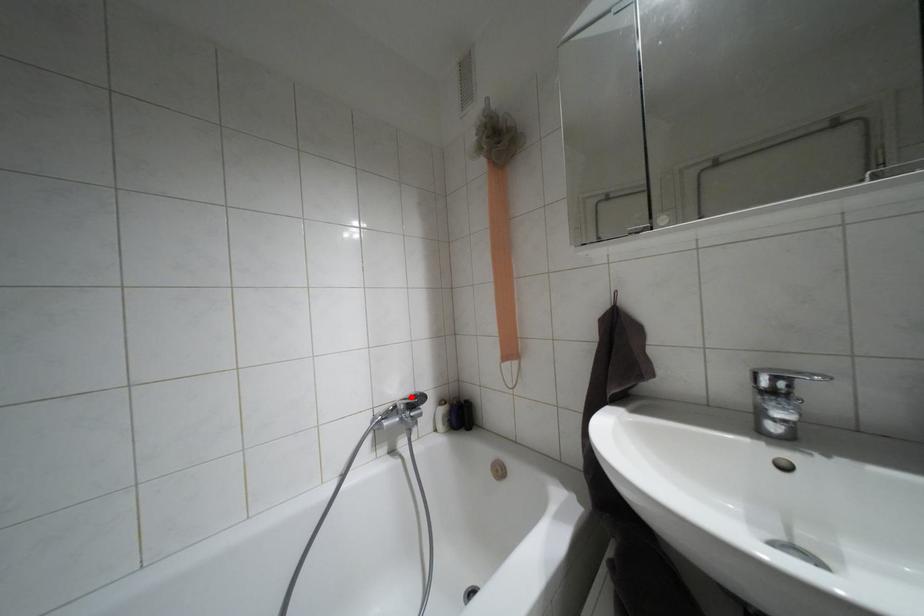
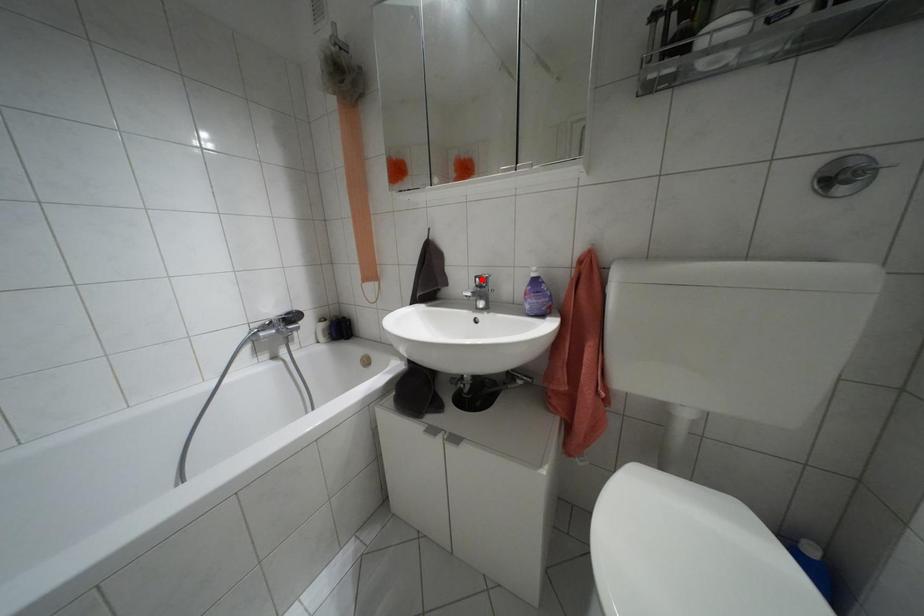
I am providing you with two images of the same scene from different viewpoints. A red point is marked on the first image and another point is marked on the second image. Are the points marked in image1 and image2 representing the same 3D position?

No